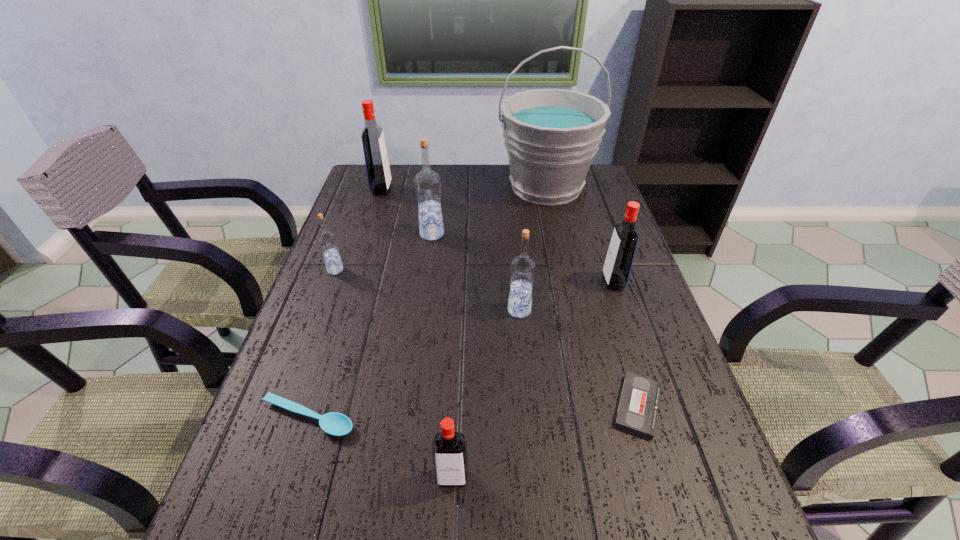
You are a GUI agent. You are given a task and a screenshot of the screen. Output one action in this format:
    pyautogui.click(x=<x>, y=<y>)
    Task: Click on the vodka that stands as the third closest to the second vodka from right to left
    Image resolution: width=960 pixels, height=540 pixels.
    Given the screenshot: What is the action you would take?
    pyautogui.click(x=449, y=447)

Point out which vodka is positioned as the fifth nearest to the second nearest vodka. Please provide its 2D coordinates. Your answer should be formatted as a tuple, i.e. [(x, y)], where the tuple contains the x and y coordinates of a point satisfying the conditions above.

[(376, 160)]

Choose which red vodka is the second nearest neighbor to the rightmost vodka. Please provide its 2D coordinates. Your answer should be formatted as a tuple, i.e. [(x, y)], where the tuple contains the x and y coordinates of a point satisfying the conditions above.

[(376, 160)]

Where is `red vodka that is the nearest to the fifth vodka from right to left`? This screenshot has height=540, width=960. red vodka that is the nearest to the fifth vodka from right to left is located at coordinates tap(620, 255).

At what (x,y) coordinates should I click in order to perform the action: click on the closest blue vodka relative to the blue spoon. Please return your answer as a coordinate pair (x, y). Looking at the image, I should click on [327, 241].

Point out which blue vodka is positioned as the second nearest to the spoon. Please provide its 2D coordinates. Your answer should be formatted as a tuple, i.e. [(x, y)], where the tuple contains the x and y coordinates of a point satisfying the conditions above.

[(522, 267)]

Locate an element on the screen. free space that satisfies the following two spatial constraints: 1. on the back side of the videotape; 2. on the right side of the spoon is located at coordinates (312, 406).

The image size is (960, 540). I want to click on vacant point that satisfies the following two spatial constraints: 1. on the front and back of the fifth vodka from right to left; 2. on the left side of the videotape, so click(313, 406).